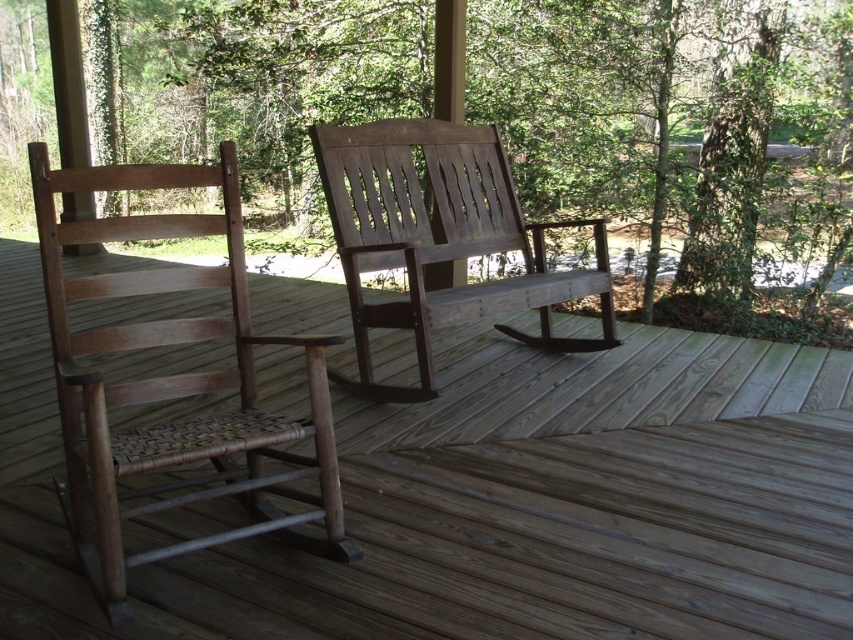
You are planning to place a small potted plant between the wooden deck at center and the wooden woven seat at left. Which object should the plant be closer to in order to maintain balance?

The wooden deck at center is bigger than the wooden woven seat at left, so the plant should be placed closer to the wooden woven seat at left to balance the sizes.

You are sitting on the wooden woven seat at left and want to reach the weathered wood rocking chair at center. Which direction should you move to get there?

You should move forward because the wooden woven seat at left is positioned under the weathered wood rocking chair at center, meaning the chair is in front of you.

You are a person with a 1.2 meter wide wheelchair. You want to move from the wooden woven seat at left to the weathered wood rocking chair at center. Can your wheelchair fit through the space between them?

The wooden woven seat at left is 94.58 centimeters away from the weathered wood rocking chair at center. Since the wheelchair is 1.2 meters wide, which is 120 centimeters, the space between them is narrower than the wheelchair. Therefore, the wheelchair cannot fit through the space between them.